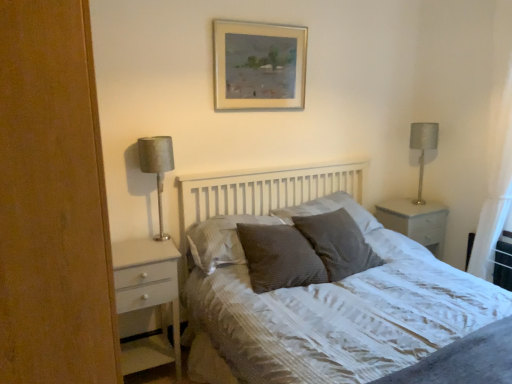
This screenshot has height=384, width=512. Describe the element at coordinates (279, 257) in the screenshot. I see `dark grey textured pillow at center, positioned as the 3th pillow in right-to-left order` at that location.

What is the approximate width of textured gray pillow at center, the 1th pillow in the right-to-left sequence?

textured gray pillow at center, the 1th pillow in the right-to-left sequence, is 39.18 centimeters wide.

In order to face textured gray pillow at center, the 1th pillow in the right-to-left sequence, should I rotate leftwards or rightwards?

Rotate right and turn 11.060 degrees.

Describe the element at coordinates (157, 167) in the screenshot. This screenshot has width=512, height=384. I see `satin silver lamp at left` at that location.

What do you see at coordinates (221, 240) in the screenshot?
I see `satin brown pillow at center, which appears as the 1th pillow when viewed from the left` at bounding box center [221, 240].

Locate an element on the screen. dark grey textured pillow at center, positioned as the 3th pillow in right-to-left order is located at coordinates (279, 257).

At what (x,y) coordinates should I click in order to perform the action: click on pillow that is the 2nd one below the textured gray pillow at center, acting as the second pillow starting from the right (from a real-world perspective). Please return your answer as a coordinate pair (x, y). This screenshot has height=384, width=512. Looking at the image, I should click on (338, 243).

Is textured gray pillow at center, positioned as the 3th pillow in left-to-right order, oriented away from textured gray pillow at center, which is the 4th pillow from left to right?

textured gray pillow at center, positioned as the 3th pillow in left-to-right order, does not have its back to textured gray pillow at center, which is the 4th pillow from left to right.

Considering the positions of points (396, 273) and (161, 180), is point (396, 273) closer to camera compared to point (161, 180)?

No, it is behind (161, 180).

Is white textured bed at center oriented away from satin silver lamp at left?

No, white textured bed at center is not facing the opposite direction of satin silver lamp at left.

From a real-world perspective, is white textured bed at center physically below satin silver lamp at left?

Correct, in the physical world, white textured bed at center is lower than satin silver lamp at left.

Is white textured bed at center outside of satin silver lamp at left?

white textured bed at center lies outside satin silver lamp at left's area.

In the scene shown: Considering the positions of objects satin silver lamp at left and white glossy nightstand at right in the image provided, who is more to the right, satin silver lamp at left or white glossy nightstand at right?

white glossy nightstand at right is more to the right.

Is there a large distance between satin silver lamp at left and white glossy nightstand at right?

That's right, there is a large distance between satin silver lamp at left and white glossy nightstand at right.

Can you confirm if satin silver lamp at left is smaller than white glossy nightstand at right?

Indeed, satin silver lamp at left has a smaller size compared to white glossy nightstand at right.

Is point (150, 148) in front of point (436, 248)?

Yes.

In the scene shown: Is satin brown pillow at center, which appears as the 1th pillow when viewed from the left, to the left of white glossy chest of drawers at left from the viewer's perspective?

Incorrect, satin brown pillow at center, which appears as the 1th pillow when viewed from the left, is not on the left side of white glossy chest of drawers at left.

In terms of height, does satin brown pillow at center, the fourth pillow when ordered from right to left, look taller or shorter compared to white glossy chest of drawers at left?

In the image, satin brown pillow at center, the fourth pillow when ordered from right to left, appears to be shorter than white glossy chest of drawers at left.

Looking at this image, can we say satin brown pillow at center, the fourth pillow when ordered from right to left, lies outside white glossy chest of drawers at left?

Yes, satin brown pillow at center, the fourth pillow when ordered from right to left, is located beyond the bounds of white glossy chest of drawers at left.

In terms of size, does satin brown pillow at center, the fourth pillow when ordered from right to left, appear bigger or smaller than white glossy chest of drawers at left?

satin brown pillow at center, the fourth pillow when ordered from right to left, is smaller than white glossy chest of drawers at left.

In terms of width, does white glossy chest of drawers at left look wider or thinner when compared to satin brown pillow at center, the fourth pillow when ordered from right to left?

Clearly, white glossy chest of drawers at left has more width compared to satin brown pillow at center, the fourth pillow when ordered from right to left.

Is white glossy chest of drawers at left in front of or behind satin brown pillow at center, the fourth pillow when ordered from right to left, in the image?

white glossy chest of drawers at left is in front of satin brown pillow at center, the fourth pillow when ordered from right to left.

Is the surface of white glossy chest of drawers at left in direct contact with satin brown pillow at center, which appears as the 1th pillow when viewed from the left?

No, white glossy chest of drawers at left is not beside satin brown pillow at center, which appears as the 1th pillow when viewed from the left.

From a real-world perspective, is white glossy chest of drawers at left under satin brown pillow at center, which appears as the 1th pillow when viewed from the left?

Indeed, from a real-world perspective, white glossy chest of drawers at left is positioned beneath satin brown pillow at center, which appears as the 1th pillow when viewed from the left.

Does white glossy nightstand at right have a larger size compared to textured gray pillow at center, which is the 4th pillow from left to right?

Yes.

Which is less distant, (426, 226) or (354, 232)?

The point (354, 232) is in front.

Could you measure the distance between white glossy nightstand at right and textured gray pillow at center, which is the 4th pillow from left to right?

A distance of 71.42 centimeters exists between white glossy nightstand at right and textured gray pillow at center, which is the 4th pillow from left to right.

In terms of height, does white glossy nightstand at right look taller or shorter compared to textured gray pillow at center, the 1th pillow in the right-to-left sequence?

In the image, white glossy nightstand at right appears to be taller than textured gray pillow at center, the 1th pillow in the right-to-left sequence.

Can you confirm if white glossy chest of drawers at left is positioned to the left of textured gray pillow at center, acting as the second pillow starting from the right?

Yes, white glossy chest of drawers at left is to the left of textured gray pillow at center, acting as the second pillow starting from the right.

Is white glossy chest of drawers at left smaller than textured gray pillow at center, acting as the second pillow starting from the right?

Incorrect, white glossy chest of drawers at left is not smaller in size than textured gray pillow at center, acting as the second pillow starting from the right.

From the picture: Considering the sizes of objects white glossy chest of drawers at left and textured gray pillow at center, acting as the second pillow starting from the right, in the image provided, who is wider, white glossy chest of drawers at left or textured gray pillow at center, acting as the second pillow starting from the right,?

textured gray pillow at center, acting as the second pillow starting from the right.

Can you tell me how much white glossy chest of drawers at left and textured gray pillow at center, positioned as the 3th pillow in left-to-right order, differ in facing direction?

The facing directions of white glossy chest of drawers at left and textured gray pillow at center, positioned as the 3th pillow in left-to-right order, are 3.62 degrees apart.

Locate an element on the screen. The width and height of the screenshot is (512, 384). pillow that is the 2nd object above the textured gray pillow at center, the 1th pillow in the right-to-left sequence (from a real-world perspective) is located at coordinates (332, 210).

The height and width of the screenshot is (384, 512). Identify the location of table lamp located above the white textured bed at center (from the image's perspective). (157, 167).

In the scene shown: Estimate the real-world distances between objects in this image. Which object is closer to satin brown pillow at center, the fourth pillow when ordered from right to left, textured gray pillow at center, which is the 4th pillow from left to right, or textured gray pillow at center, acting as the second pillow starting from the right?

Among the two, textured gray pillow at center, which is the 4th pillow from left to right, is located nearer to satin brown pillow at center, the fourth pillow when ordered from right to left.

Looking at the image, which one is located closer to silver metallic lampshade at right, satin brown pillow at center, the fourth pillow when ordered from right to left, or white textured bed at center?

white textured bed at center.

When comparing their distances from dark grey textured pillow at center, positioned as the 2th pillow in left-to-right order, does white glossy nightstand at right or silver metallic lampshade at right seem further?

silver metallic lampshade at right lies further to dark grey textured pillow at center, positioned as the 2th pillow in left-to-right order, than the other object.

Looking at the image, which one is located further to white sheer curtain at right, white textured bed at center or satin brown pillow at center, which appears as the 1th pillow when viewed from the left?

satin brown pillow at center, which appears as the 1th pillow when viewed from the left.

Based on their spatial positions, is white glossy chest of drawers at left or satin silver lamp at left closer to textured gray pillow at center, which is the 4th pillow from left to right?

white glossy chest of drawers at left is positioned closer to the anchor textured gray pillow at center, which is the 4th pillow from left to right.

Estimate the real-world distances between objects in this image. Which object is closer to dark grey textured pillow at center, positioned as the 2th pillow in left-to-right order, gold-framed painting at upper center or white sheer curtain at right?

Among the two, gold-framed painting at upper center is located nearer to dark grey textured pillow at center, positioned as the 2th pillow in left-to-right order.

Estimate the real-world distances between objects in this image. Which object is closer to textured gray pillow at center, acting as the second pillow starting from the right, textured gray pillow at center, the 1th pillow in the right-to-left sequence, or white glossy chest of drawers at left?

textured gray pillow at center, the 1th pillow in the right-to-left sequence, is closer to textured gray pillow at center, acting as the second pillow starting from the right.

Which object lies further to the anchor point white textured bed at center, white glossy chest of drawers at left or white glossy nightstand at right?

Based on the image, white glossy nightstand at right appears to be further to white textured bed at center.

The height and width of the screenshot is (384, 512). In order to click on chest of drawers between white textured bed at center and white glossy nightstand at right from front to back in this screenshot , I will do `click(148, 299)`.

You are a GUI agent. You are given a task and a screenshot of the screen. Output one action in this format:
    pyautogui.click(x=<x>, y=<y>)
    Task: Click on the pillow located between dark grey textured pillow at center, positioned as the 2th pillow in left-to-right order, and textured gray pillow at center, which is the 4th pillow from left to right, in the left-right direction
    Image resolution: width=512 pixels, height=384 pixels.
    Given the screenshot: What is the action you would take?
    pyautogui.click(x=332, y=210)

Find the location of a particular element. The width and height of the screenshot is (512, 384). picture frame between satin brown pillow at center, the fourth pillow when ordered from right to left, and white sheer curtain at right, in the horizontal direction is located at coordinates (259, 65).

Identify the location of nightstand located between satin brown pillow at center, the fourth pillow when ordered from right to left, and white sheer curtain at right in the left-right direction. This screenshot has width=512, height=384. (416, 221).